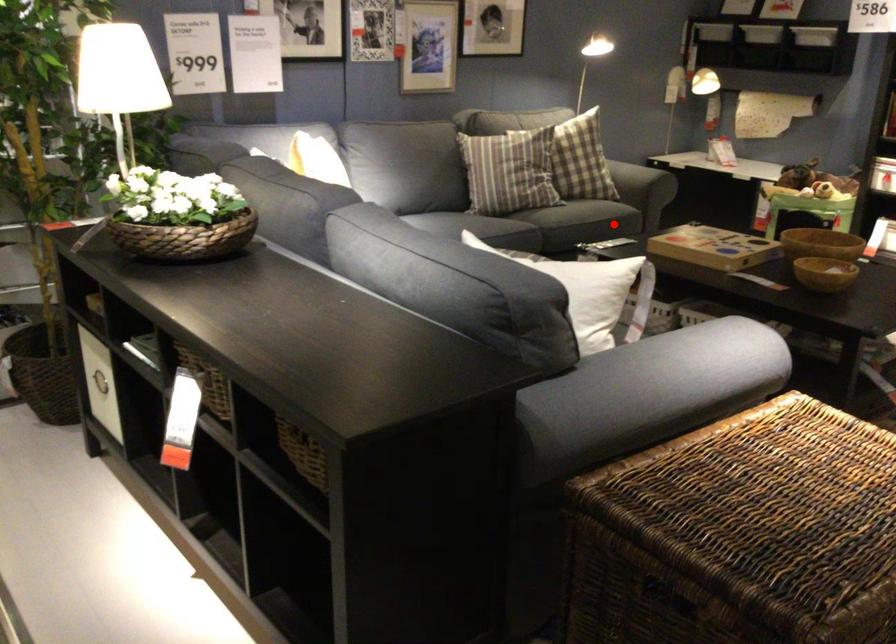
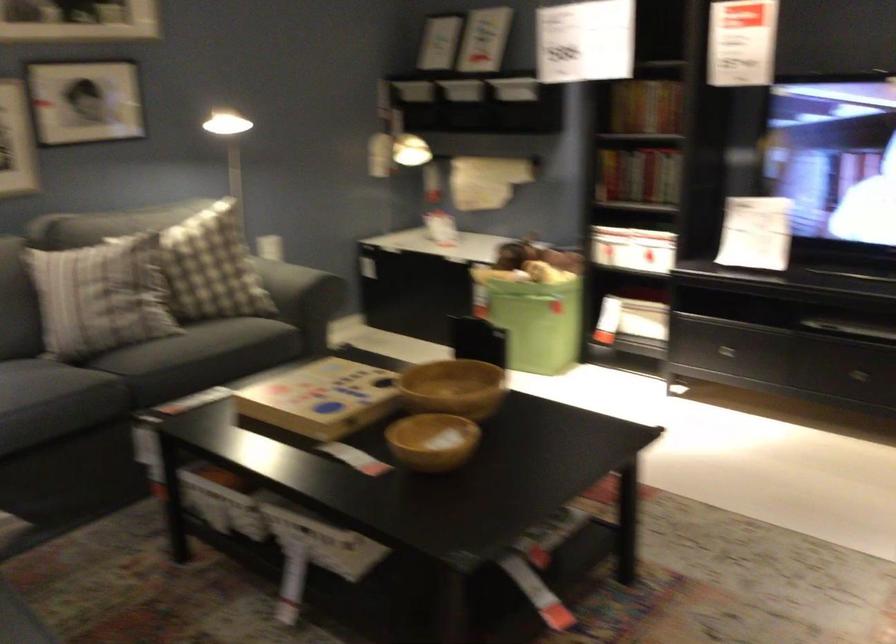
In the second image, find the point that corresponds to the highlighted location in the first image.

(199, 357)